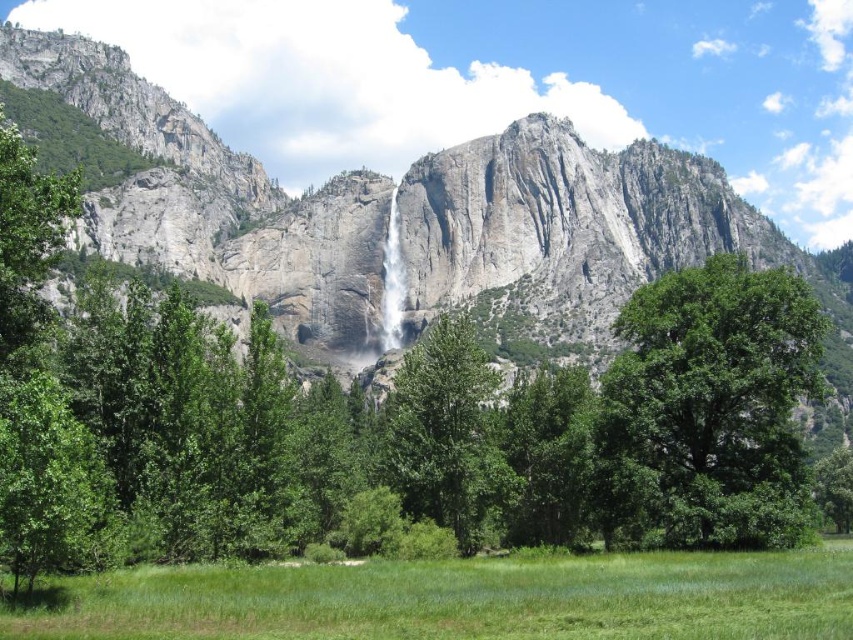
You are standing in the meadow and want to take a photo of both the green leafy tree at right and the white smooth waterfall at center. Which object should you focus on first to ensure both are in clear view?

You should focus on the green leafy tree at right first because it is closer to you than the white smooth waterfall at center, so adjusting focus from near to far will help both be in clear view.

You are standing on the green grassy pasture at lower center and want to take a photo of the green leafy tree at center. Since the pasture is shorter than the tree, will you be able to see the entire tree from your current position?

The green grassy pasture at lower center is shorter than the green leafy tree at center, so yes, you can see the entire tree from your current position as the pasture does not obstruct the view.

In the scene shown: You are standing at the edge of the green grassy pasture at lower center and want to cross to the other side. The white smooth waterfall at center is in your way. Can you walk around the waterfall without leaving the pasture?

The green grassy pasture at lower center is wider than the white smooth waterfall at center, so yes, you can walk around the waterfall without leaving the pasture by staying on the wider pasture area.